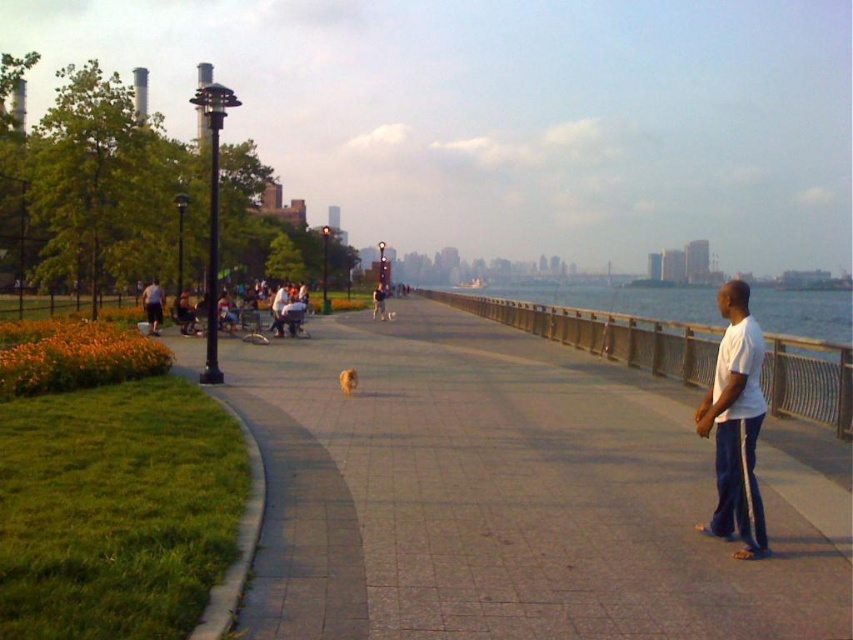
You are standing on the waterfront promenade and want to take a photo of the clear glass waterway at center without the dark gray shirt at left appearing in the shot. Is it possible to do so without moving either object?

The clear glass waterway at center is in front of the dark gray shirt at left, so you can take the photo without the dark gray shirt at left being visible as it is obscured by the waterway.

You are a photographer trying to capture a photo of the waterfront promenade. You notice the matte black stroller at left and the white cotton shirt at center. Based on their heights, which object should you focus on to ensure it appears larger in your photo?

The white cotton shirt at center is taller than the matte black stroller at left, so focusing on it would make it appear larger in the photo.